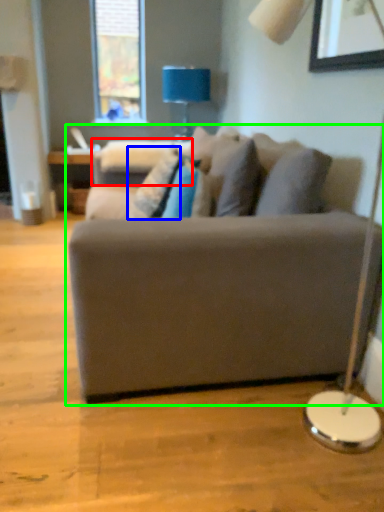
Question: Estimate the real-world distances between objects in this image. Which object is farther from swivel chair (highlighted by a red box), pillow (highlighted by a blue box) or studio couch (highlighted by a green box)?

Choices:
 (A) pillow
 (B) studio couch

Answer: (B)